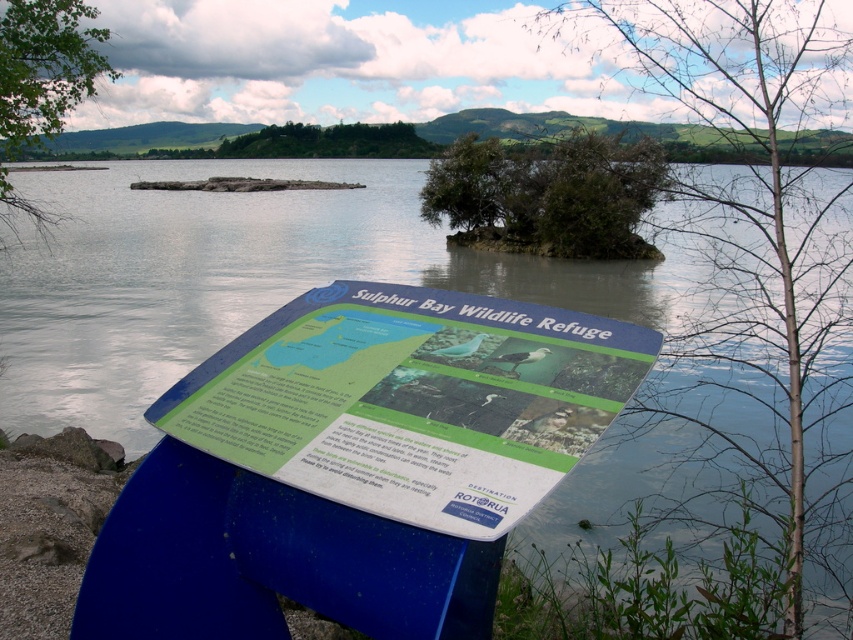
Which is more to the left, green leafy tree at center or green leafy bush at center?

From the viewer's perspective, green leafy tree at center appears more on the left side.

Which is more to the right, green leafy tree at center or green leafy bush at center?

From the viewer's perspective, green leafy bush at center appears more on the right side.

Is point (751, 282) more distant than point (456, 156)?

No.

Where is `green leafy tree at center`? green leafy tree at center is located at coordinates (759, 237).

Does point (630, 248) come closer to viewer compared to point (109, 68)?

No.

Can you confirm if green leafy bush at center is positioned to the right of green leafy tree at upper left?

Yes, green leafy bush at center is to the right of green leafy tree at upper left.

Find the location of a particular element. green leafy bush at center is located at coordinates (548, 193).

Is green leafy tree at center smaller than green leafy tree at upper left?

Correct, green leafy tree at center occupies less space than green leafy tree at upper left.

Which is in front, point (811, 522) or point (15, 90)?

Point (811, 522) is more forward.

Where is `green leafy tree at center`? Image resolution: width=853 pixels, height=640 pixels. green leafy tree at center is located at coordinates (759, 237).